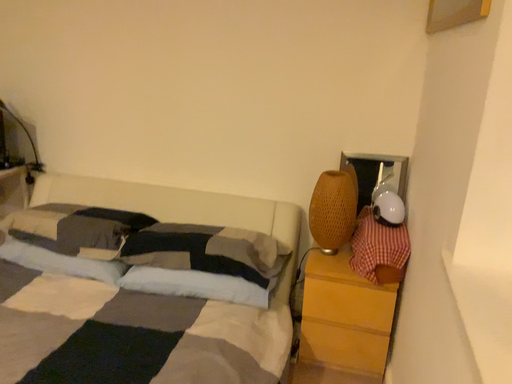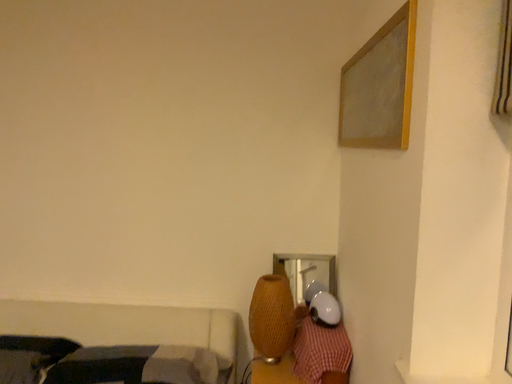
Question: Which way did the camera rotate in the video?

Choices:
 (A) rotated left
 (B) rotated right

Answer: (B)